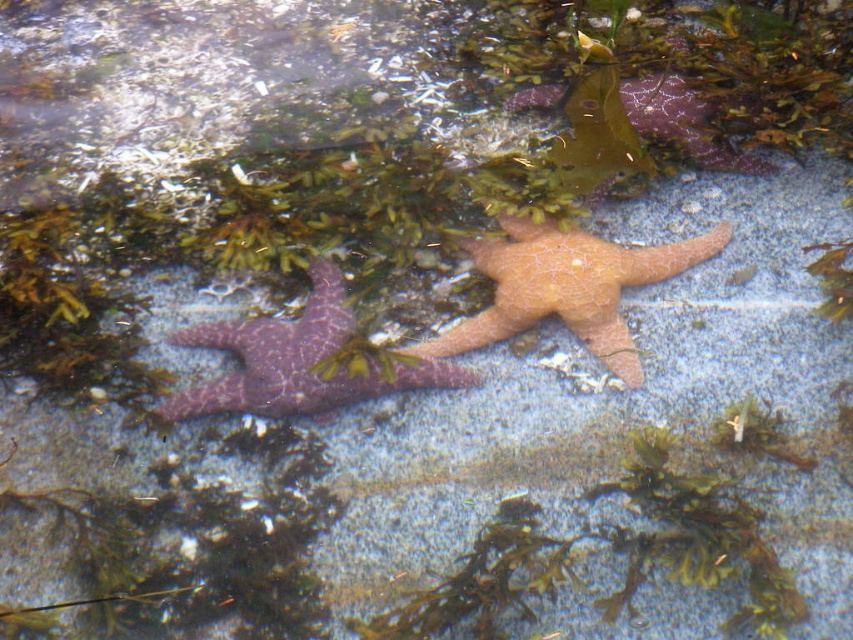
Question: Among these objects, which one is nearest to the camera?

Choices:
 (A) orange matte starfish at center
 (B) purple matte starfish at center

Answer: (B)

Question: Which point is closer to the camera?

Choices:
 (A) purple matte starfish at center
 (B) orange matte starfish at center

Answer: (A)

Question: Is orange matte starfish at center wider than purple matte starfish at center?

Choices:
 (A) no
 (B) yes

Answer: (B)

Question: Does orange matte starfish at center have a lesser width compared to purple matte starfish at center?

Choices:
 (A) yes
 (B) no

Answer: (B)

Question: Among these points, which one is nearest to the camera?

Choices:
 (A) (x=439, y=342)
 (B) (x=282, y=381)

Answer: (B)

Question: Does orange matte starfish at center have a greater width compared to purple matte starfish at center?

Choices:
 (A) no
 (B) yes

Answer: (B)